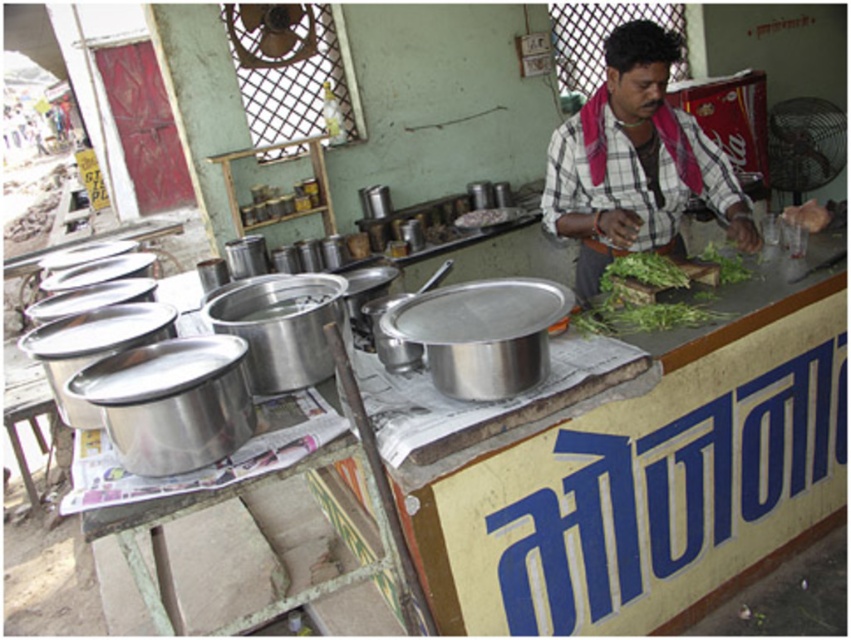
Question: Can you confirm if white checkered shirt at upper right is wider than green leafy vegetable at center?

Choices:
 (A) no
 (B) yes

Answer: (B)

Question: Which object appears farthest from the camera in this image?

Choices:
 (A) white checkered shirt at upper right
 (B) green leafy vegetable at center

Answer: (B)

Question: In this image, where is white checkered shirt at upper right located relative to green leafy vegetable at center?

Choices:
 (A) right
 (B) left

Answer: (B)

Question: Among these objects, which one is nearest to the camera?

Choices:
 (A) white checkered shirt at upper right
 (B) green leafy vegetable at center

Answer: (A)

Question: Which point is farther from the camera taking this photo?

Choices:
 (A) (726, 244)
 (B) (750, 211)

Answer: (A)

Question: In this image, where is white checkered shirt at upper right located relative to green leafy vegetable at center?

Choices:
 (A) right
 (B) left

Answer: (B)